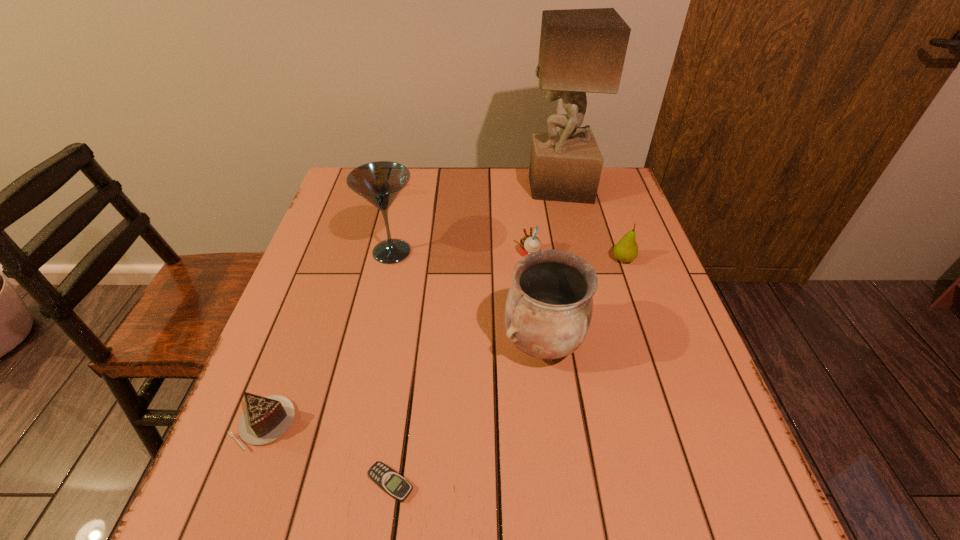
Find the location of a particular element. vacant region located on the front-facing side of the sculpture is located at coordinates (502, 187).

Where is `vacant area located on the front-facing side of the sculpture`? The width and height of the screenshot is (960, 540). vacant area located on the front-facing side of the sculpture is located at coordinates (431, 187).

Image resolution: width=960 pixels, height=540 pixels. In order to click on vacant area situated on the front-facing side of the sculpture in this screenshot , I will do `click(492, 187)`.

Where is `vacant region located 0.270m on the front of the martini`? This screenshot has height=540, width=960. vacant region located 0.270m on the front of the martini is located at coordinates (368, 360).

Where is `free space located 0.120m on the back of the fifth farthest object`? Image resolution: width=960 pixels, height=540 pixels. free space located 0.120m on the back of the fifth farthest object is located at coordinates (535, 276).

Identify the location of vacant space located on the left of the pear. This screenshot has width=960, height=540. (558, 260).

This screenshot has height=540, width=960. I want to click on vacant space located on the front-facing side of the third shortest object, so click(x=377, y=254).

At what (x,y) coordinates should I click in order to perform the action: click on free space located 0.280m on the front-facing side of the third shortest object. Please return your answer as a coordinate pair (x, y). This screenshot has width=960, height=540. Looking at the image, I should click on (412, 254).

You are a GUI agent. You are given a task and a screenshot of the screen. Output one action in this format:
    pyautogui.click(x=<x>, y=<y>)
    Task: Click on the vacant space situated on the front-facing side of the third shortest object
    
    Given the screenshot: What is the action you would take?
    pyautogui.click(x=477, y=254)

Find the location of `free spot located 0.240m on the right of the second shortest object`. free spot located 0.240m on the right of the second shortest object is located at coordinates (424, 423).